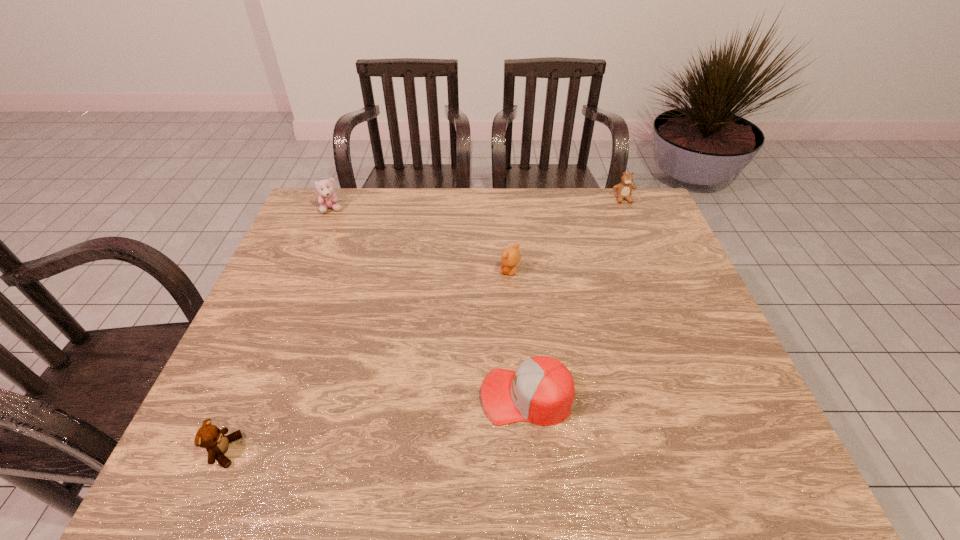
You are a GUI agent. You are given a task and a screenshot of the screen. Output one action in this format:
    pyautogui.click(x=<x>, y=<y>)
    Task: Click on the rightmost object
    The height and width of the screenshot is (540, 960).
    Given the screenshot: What is the action you would take?
    pyautogui.click(x=624, y=189)

Locate an element on the screen. The height and width of the screenshot is (540, 960). the third teddy bear from left to right is located at coordinates (511, 256).

Where is `the third nearest object`? the third nearest object is located at coordinates (511, 256).

Find the location of a particular element. baseball cap is located at coordinates (541, 391).

The image size is (960, 540). I want to click on the nearest object, so click(x=209, y=436).

Locate an element on the screen. This screenshot has width=960, height=540. free region located 0.240m on the front-facing side of the rightmost object is located at coordinates (644, 250).

Locate an element on the screen. The height and width of the screenshot is (540, 960). vacant space situated 0.400m on the face of the second teddy bear from right to left is located at coordinates (361, 272).

Locate an element on the screen. vacant space situated 0.310m on the face of the second teddy bear from right to left is located at coordinates (x=392, y=272).

Locate an element on the screen. This screenshot has width=960, height=540. vacant area situated on the face of the second teddy bear from right to left is located at coordinates (368, 272).

Identify the location of vacant space located on the front-facing side of the fourth farthest object. (441, 396).